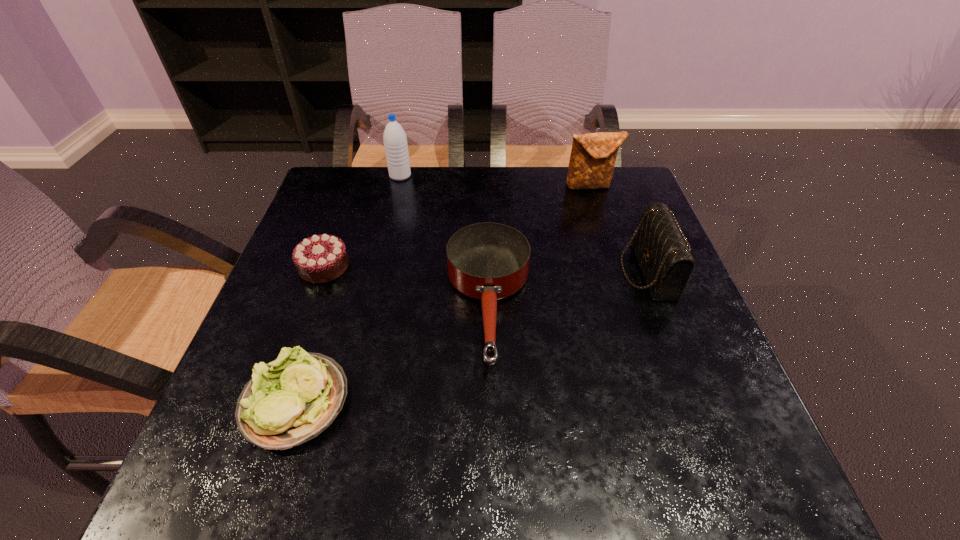
You are a GUI agent. You are given a task and a screenshot of the screen. Output one action in this format:
    pyautogui.click(x=<x>, y=<y>)
    Task: Click on the object that is positioned at the near left corner
    Image resolution: width=960 pixels, height=540 pixels.
    Given the screenshot: What is the action you would take?
    pyautogui.click(x=293, y=399)

I want to click on object that is at the far right corner, so click(x=593, y=155).

Locate an element on the screen. vacant area at the far edge of the desktop is located at coordinates [x=429, y=178].

You are a GUI agent. You are given a task and a screenshot of the screen. Output one action in this format:
    pyautogui.click(x=<x>, y=<y>)
    Task: Click on the free space at the left edge of the desktop
    
    Given the screenshot: What is the action you would take?
    pyautogui.click(x=291, y=336)

You are a GUI agent. You are given a task and a screenshot of the screen. Output one action in this format:
    pyautogui.click(x=<x>, y=<y>)
    Task: Click on the free space at the right edge of the desktop
    
    Given the screenshot: What is the action you would take?
    pyautogui.click(x=692, y=302)

Locate an element on the screen. vacant region at the far left corner of the desktop is located at coordinates (381, 171).

The height and width of the screenshot is (540, 960). In the image, there is a desktop. Find the location of `free space at the near right corner`. free space at the near right corner is located at coordinates (666, 449).

The height and width of the screenshot is (540, 960). Identify the location of empty location between the taller clutch bag and the lettuce. (443, 294).

Image resolution: width=960 pixels, height=540 pixels. In order to click on blank region between the lettuce and the chocolate cake in this screenshot , I will do `click(310, 334)`.

This screenshot has width=960, height=540. I want to click on empty space that is in between the farther clutch bag and the lettuce, so click(x=443, y=294).